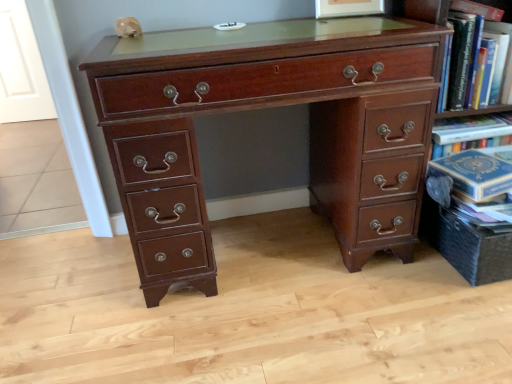
Question: From a real-world perspective, relative to hardcover book at upper right, is mahogany wood desk at center vertically above or below?

Choices:
 (A) above
 (B) below

Answer: (B)

Question: Is mahogany wood desk at center wider or thinner than hardcover book at upper right?

Choices:
 (A) wide
 (B) thin

Answer: (A)

Question: From the image's perspective, is mahogany wood desk at center above or below hardcover book at upper right?

Choices:
 (A) above
 (B) below

Answer: (B)

Question: Is point (448, 72) closer or farther from the camera than point (229, 107)?

Choices:
 (A) closer
 (B) farther

Answer: (B)

Question: Considering the relative positions of hardcover book at upper right and mahogany wood desk at center in the image provided, is hardcover book at upper right to the left or to the right of mahogany wood desk at center?

Choices:
 (A) right
 (B) left

Answer: (A)

Question: From the image's perspective, is hardcover book at upper right located above or below mahogany wood desk at center?

Choices:
 (A) below
 (B) above

Answer: (B)

Question: From a real-world perspective, is hardcover book at upper right positioned above or below mahogany wood desk at center?

Choices:
 (A) above
 (B) below

Answer: (A)